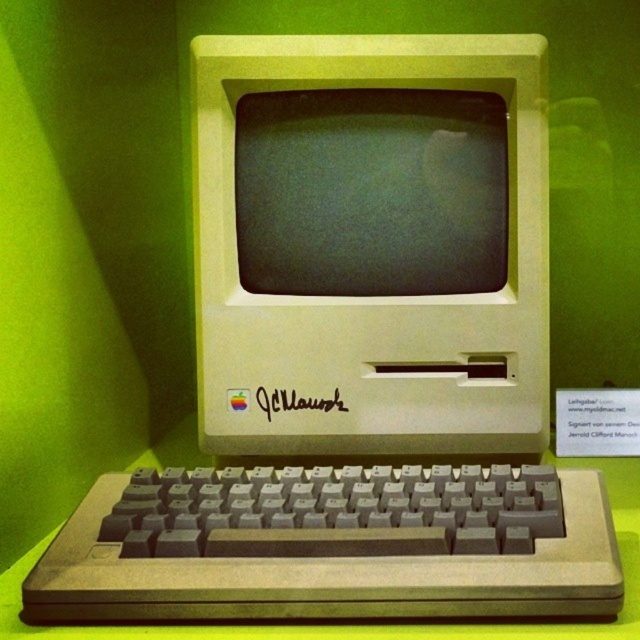
Is beige plastic monitor at center thinner than matte plastic screen at center?

In fact, beige plastic monitor at center might be wider than matte plastic screen at center.

Which is behind, point (493, 364) or point (326, 225)?

The point (326, 225) is more distant.

Is point (458, 83) positioned behind point (376, 188)?

No, (458, 83) is closer to viewer.

Image resolution: width=640 pixels, height=640 pixels. Identify the location of beige plastic monitor at center. click(372, 243).

Is gray plastic keyboard at lower center shorter than black signature at center?

No.

Find the location of a particular element. Image resolution: width=640 pixels, height=640 pixels. gray plastic keyboard at lower center is located at coordinates (332, 547).

Can you confirm if gray plastic keyboard at lower center is positioned below matte plastic screen at center?

Correct, gray plastic keyboard at lower center is located below matte plastic screen at center.

Which of these two, gray plastic keyboard at lower center or matte plastic screen at center, stands shorter?

gray plastic keyboard at lower center

Where is `gray plastic keyboard at lower center`? This screenshot has height=640, width=640. gray plastic keyboard at lower center is located at coordinates (332, 547).